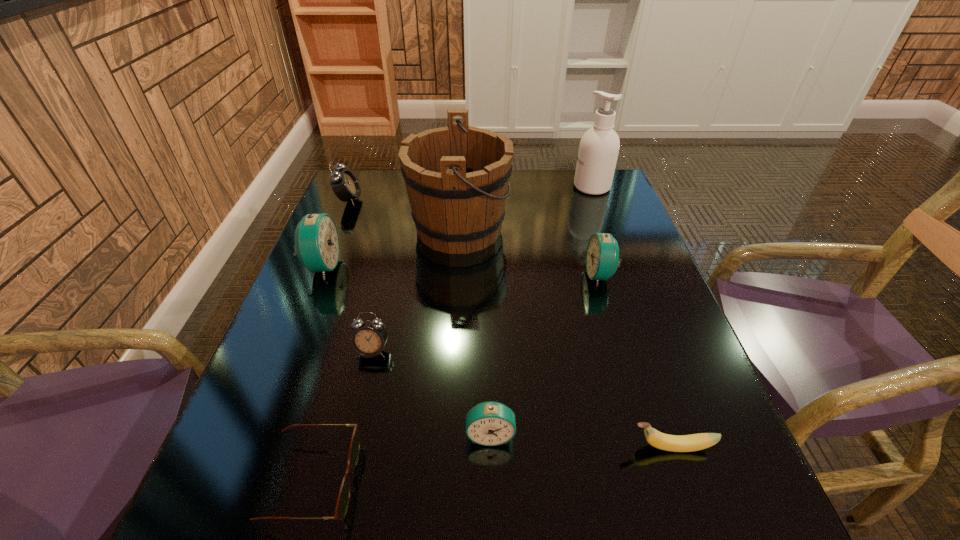
The width and height of the screenshot is (960, 540). Find the location of `the nearest alarm clock`. the nearest alarm clock is located at coordinates (490, 423).

Find the location of a particular element. Image resolution: width=960 pixels, height=540 pixels. the nearest blue alarm clock is located at coordinates (490, 423).

Identify the location of banana. This screenshot has width=960, height=540. (676, 443).

This screenshot has height=540, width=960. In order to click on the eighth tallest object in this screenshot , I will do `click(676, 443)`.

I want to click on the shortest object, so click(x=344, y=494).

Image resolution: width=960 pixels, height=540 pixels. I want to click on brown spectacles, so click(344, 494).

Locate an element on the screen. The image size is (960, 540). free space located 0.200m on the front label of the cleansing agent is located at coordinates (509, 187).

At what (x,y) coordinates should I click in order to perform the action: click on free space located 0.230m on the front label of the cleansing agent. Please return your answer as a coordinate pair (x, y). The image size is (960, 540). Looking at the image, I should click on (499, 187).

The image size is (960, 540). Identify the location of free region located on the front label of the cleansing agent. (499, 187).

Image resolution: width=960 pixels, height=540 pixels. In order to click on free point located 0.080m on the side of the wine bucket with the handle for carrying in this screenshot , I will do `click(538, 228)`.